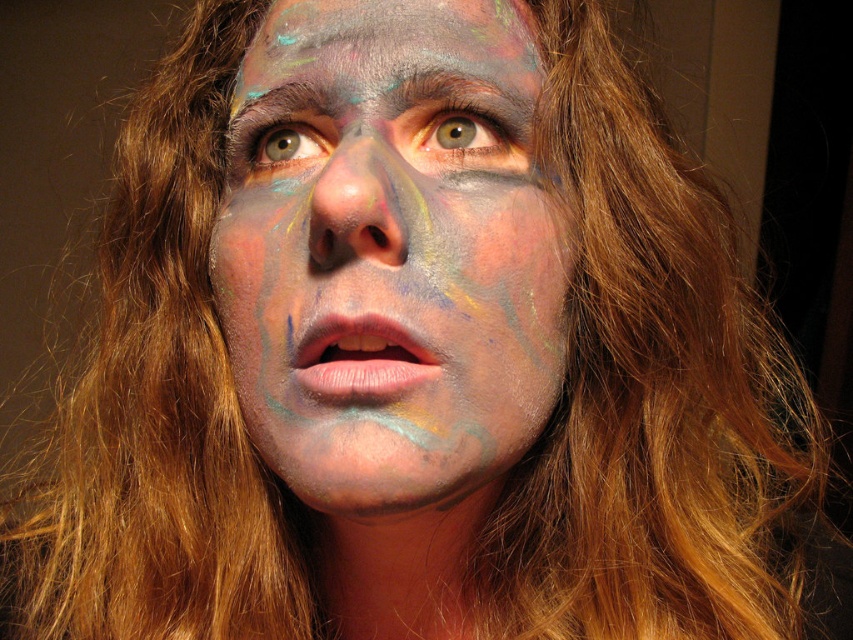
Question: Which object is the closest to the multicolored paint at center?

Choices:
 (A) matte multicolored face paint at center
 (B) matte green eye at center

Answer: (B)

Question: Which of these objects is positioned farthest from the matte green eye at center?

Choices:
 (A) matte multicolored face paint at center
 (B) multicolored paint at center

Answer: (B)

Question: Does multicolored paint at center appear on the left side of matte green eye at center?

Choices:
 (A) yes
 (B) no

Answer: (A)

Question: Does multicolored paint at center have a smaller size compared to matte green eye at center?

Choices:
 (A) no
 (B) yes

Answer: (A)

Question: Which object is the closest to the matte multicolored face paint at center?

Choices:
 (A) multicolored paint at center
 (B) matte green eye at center

Answer: (B)

Question: From the image, what is the correct spatial relationship of matte green eye at center in relation to matte multicolored face paint at center?

Choices:
 (A) right
 (B) left

Answer: (A)